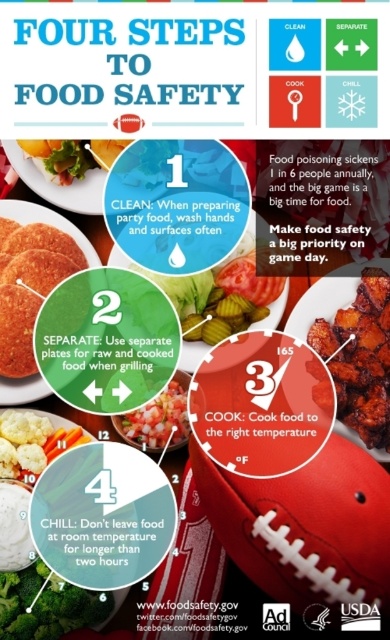
Can you confirm if matte brown plate at center is wider than green leafy broccoli at lower left?

No.

Can you confirm if matte brown plate at center is positioned below green leafy broccoli at lower left?

Incorrect, matte brown plate at center is not positioned below green leafy broccoli at lower left.

Locate an element on the screen. This screenshot has width=390, height=640. matte brown plate at center is located at coordinates (28, 285).

This screenshot has width=390, height=640. I want to click on matte brown plate at center, so click(28, 285).

Does charred crispy chicken at center have a greater width compared to matte plastic plate at upper left?

No, charred crispy chicken at center is not wider than matte plastic plate at upper left.

Which is in front, point (372, 433) or point (108, 145)?

Point (372, 433)

Looking at this image, who is more forward, (359, 348) or (54, 161)?

Positioned in front is point (359, 348).

This screenshot has width=390, height=640. Identify the location of charred crispy chicken at center. (361, 358).

Is chopped tomato salad at center positioned at the back of matte plastic plate at upper left?

Yes, it is.

Is point (122, 429) in front of point (69, 140)?

No, it is behind (69, 140).

Where is `chopped tomato salad at center`? chopped tomato salad at center is located at coordinates (159, 419).